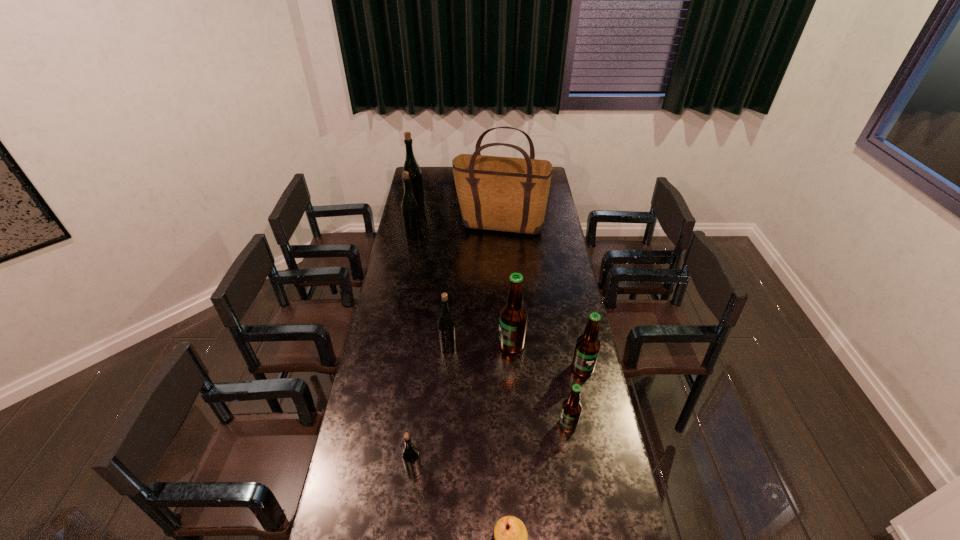
At what (x,y) coordinates should I click in order to perform the action: click on the rightmost brown beer bottle. Please return your answer as a coordinate pair (x, y). The width and height of the screenshot is (960, 540). Looking at the image, I should click on (588, 345).

At what (x,y) coordinates should I click in order to perform the action: click on the second nearest beer bottle. Please return your answer as a coordinate pair (x, y). The height and width of the screenshot is (540, 960). Looking at the image, I should click on 571,409.

The image size is (960, 540). Identify the location of the second brown beer bottle from right to left. (571, 409).

You are a GUI agent. You are given a task and a screenshot of the screen. Output one action in this format:
    pyautogui.click(x=<x>, y=<y>)
    Task: Click on the third object from left to right
    This screenshot has height=540, width=960.
    Given the screenshot: What is the action you would take?
    pyautogui.click(x=411, y=459)

Where is `the second green beer bottle from right to left`? This screenshot has height=540, width=960. the second green beer bottle from right to left is located at coordinates (411, 459).

Where is `free space located 0.180m on the back of the tote bag`? free space located 0.180m on the back of the tote bag is located at coordinates (498, 198).

Locate an element on the screen. free spot located on the back of the biggest green beer bottle is located at coordinates (419, 189).

The height and width of the screenshot is (540, 960). In order to click on vacant position located 0.130m on the back of the second farthest beer bottle in this screenshot , I will do `click(417, 216)`.

Where is `vacant space located on the label of the leftmost brown beer bottle`? vacant space located on the label of the leftmost brown beer bottle is located at coordinates (471, 345).

At what (x,y) coordinates should I click in order to perform the action: click on free space located on the label of the leftmost brown beer bottle. Please return your answer as a coordinate pair (x, y). Looking at the image, I should click on (435, 345).